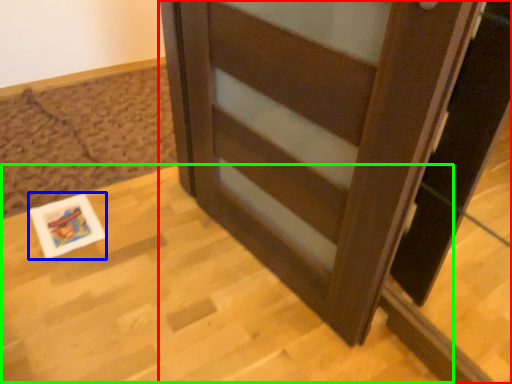
Question: Estimate the real-world distances between objects in this image. Which object is closer to furniture (highlighted by a red box), postcard (highlighted by a blue box) or table (highlighted by a green box)?

Choices:
 (A) postcard
 (B) table

Answer: (B)